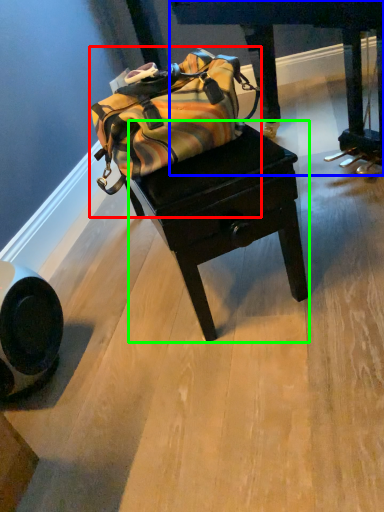
Question: Which is farther away from luggage and bags (highlighted by a red box)? furniture (highlighted by a blue box) or table (highlighted by a green box)?

Choices:
 (A) furniture
 (B) table

Answer: (A)